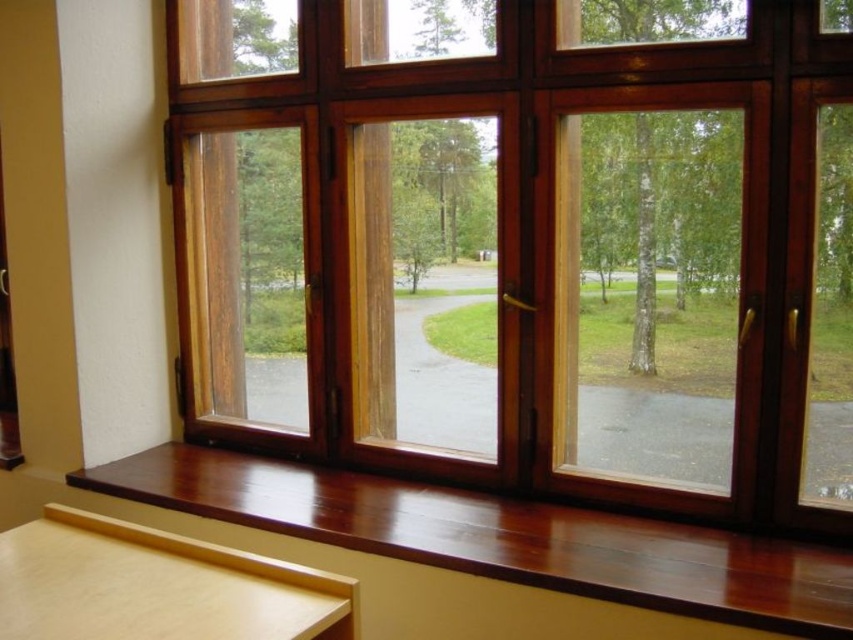
Question: Can you confirm if mahogany wood window sill at lower center is positioned to the left of green leafy tree at upper left?

Choices:
 (A) no
 (B) yes

Answer: (A)

Question: Can you confirm if wooden bay window at center is thinner than mahogany wood window sill at lower center?

Choices:
 (A) yes
 (B) no

Answer: (A)

Question: Which object is closer to the camera taking this photo?

Choices:
 (A) green leafy tree at upper left
 (B) wooden bay window at center
 (C) mahogany wood window sill at lower center

Answer: (C)

Question: Does wooden bay window at center have a smaller size compared to green leafy tree at upper left?

Choices:
 (A) no
 (B) yes

Answer: (A)

Question: Which point is closer to the camera?

Choices:
 (A) (631, 125)
 (B) (374, 179)
 (C) (410, 490)

Answer: (A)

Question: Estimate the real-world distances between objects in this image. Which object is closer to the green leafy tree at upper left?

Choices:
 (A) wooden bay window at center
 (B) mahogany wood window sill at lower center
 (C) green matte tree at center

Answer: (A)